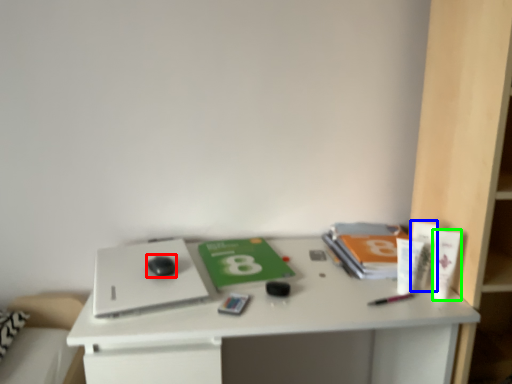
Question: Which object is the closest to the mouse (highlighted by a red box)? Choose among these: toiletry (highlighted by a blue box) or toiletry (highlighted by a green box).

Choices:
 (A) toiletry
 (B) toiletry

Answer: (A)